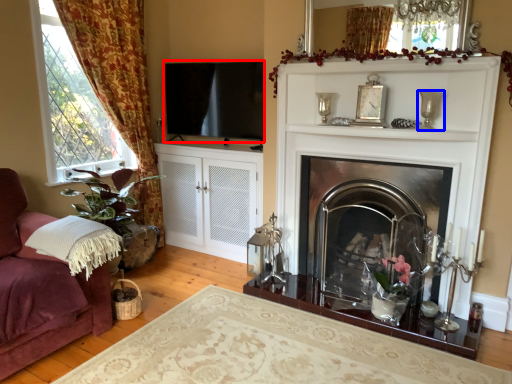
Question: Among these objects, which one is farthest to the camera, window screen (highlighted by a red box) or candle holder (highlighted by a blue box)?

Choices:
 (A) window screen
 (B) candle holder

Answer: (A)